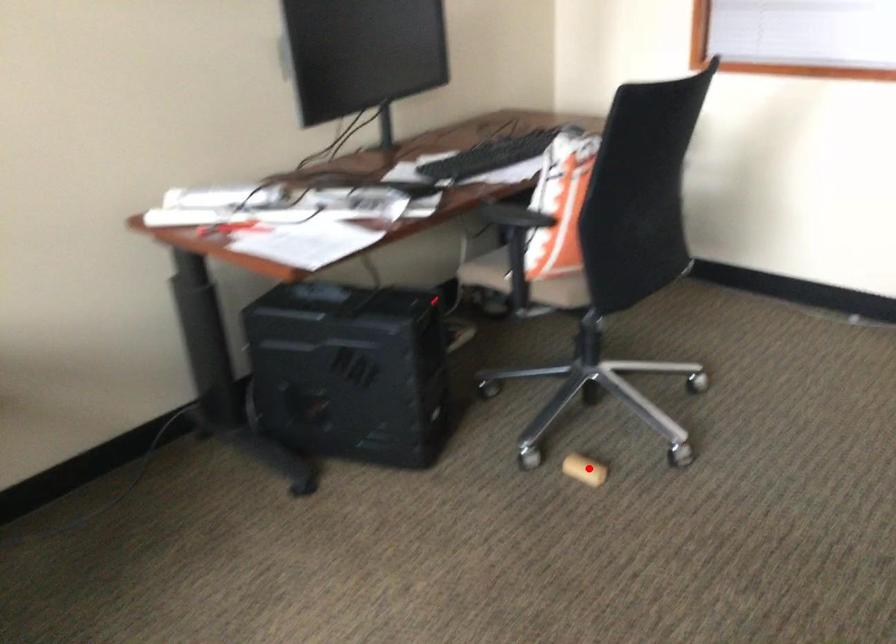
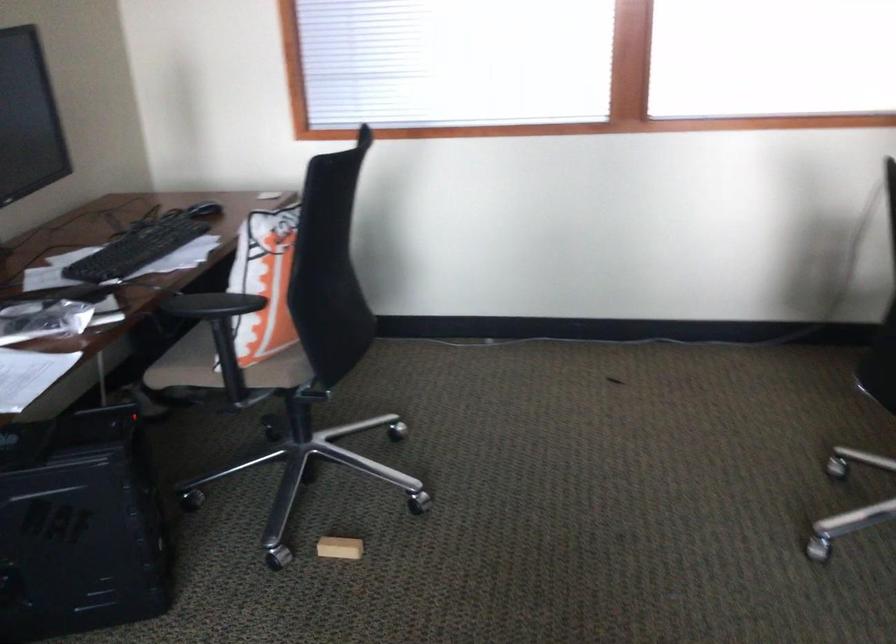
Where in the second image is the point corresponding to the highlighted location from the first image?

(339, 547)